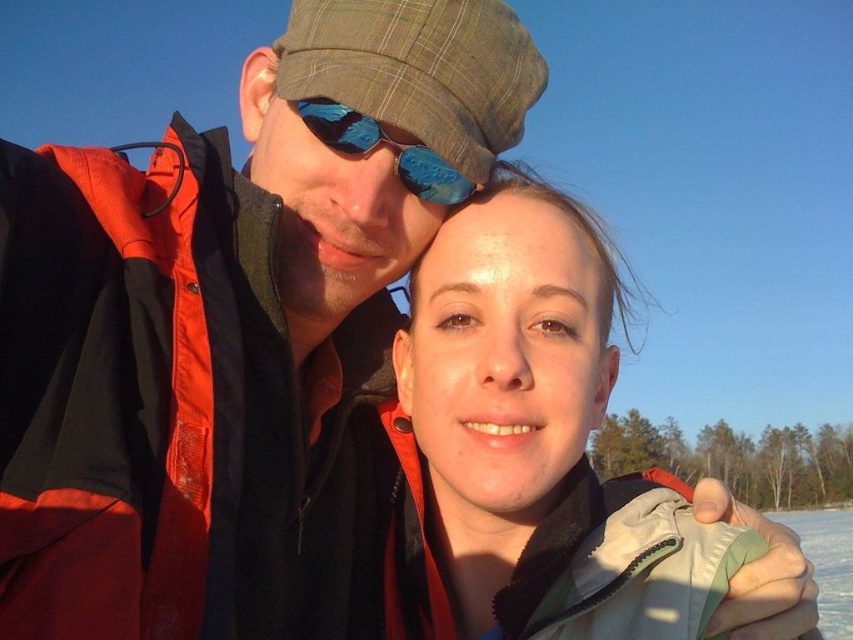
You are a photographer planning to take a portrait of the two people in the image. You want to ensure that the matte black jacket at center and the blue reflective lens at center are both clearly visible in the photo. Given their sizes, which object should you focus on to ensure both are in sharp focus?

The matte black jacket at center is much taller than the blue reflective lens at center, so focusing on the matte black jacket at center will ensure both are in sharp focus since it is larger and likely closer to the camera.

You are a photographer trying to capture a close detail shot of the blue reflective lens at center while ensuring the matte black jacket at center is still visible in the frame. Given their size difference, will you need to adjust your camera angle to include both?

The matte black jacket at center has a larger size compared to blue reflective lens at center, so you will need to adjust your camera angle to ensure both the matte black jacket at center and the blue reflective lens at center are visible in the frame due to the size difference.